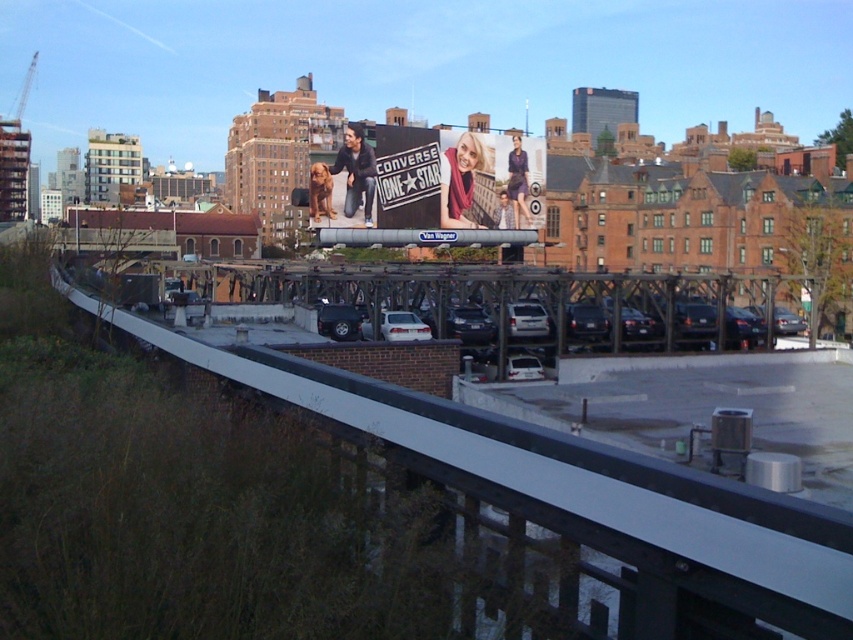
Question: Which object is positioned closest to the metallic gray overpass at center?

Choices:
 (A) matte white billboard at center
 (B) white matte car at center

Answer: (B)

Question: Which of these objects is positioned farthest from the metallic gray overpass at center?

Choices:
 (A) matte white billboard at center
 (B) white matte car at center

Answer: (A)

Question: Is metallic gray overpass at center behind white matte car at center?

Choices:
 (A) no
 (B) yes

Answer: (A)

Question: Can you confirm if metallic gray overpass at center is positioned below matte white billboard at center?

Choices:
 (A) yes
 (B) no

Answer: (A)

Question: Is the position of metallic gray overpass at center more distant than that of white matte car at center?

Choices:
 (A) yes
 (B) no

Answer: (B)

Question: Among these objects, which one is nearest to the camera?

Choices:
 (A) white glossy sedan at center
 (B) white smooth train track at center
 (C) matte white billboard at center

Answer: (B)